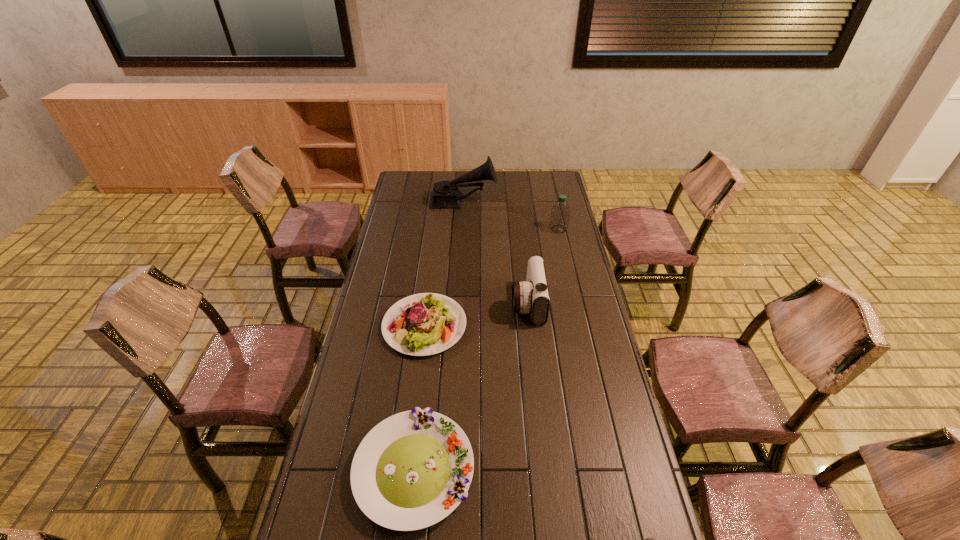
In the image, there is a desktop. Identify the location of vacant space at the far left corner. The height and width of the screenshot is (540, 960). (424, 181).

You are a GUI agent. You are given a task and a screenshot of the screen. Output one action in this format:
    pyautogui.click(x=<x>, y=<y>)
    Task: Click on the vacant space at the far right corner of the desktop
    The width and height of the screenshot is (960, 540).
    Given the screenshot: What is the action you would take?
    pyautogui.click(x=543, y=184)

Where is `empty space between the taller salad plate and the camcorder`? The image size is (960, 540). empty space between the taller salad plate and the camcorder is located at coordinates (476, 314).

At what (x,y) coordinates should I click in order to perform the action: click on vacant area between the farther salad plate and the camcorder. Please return your answer as a coordinate pair (x, y). Looking at the image, I should click on (476, 314).

Identify the location of free space between the farther salad plate and the water bottle. The width and height of the screenshot is (960, 540). (492, 278).

The height and width of the screenshot is (540, 960). Find the location of `free point between the fifth nearest object and the shorter salad plate`. free point between the fifth nearest object and the shorter salad plate is located at coordinates (486, 349).

I want to click on empty space between the water bottle and the farthest object, so click(x=511, y=215).

You are a GUI agent. You are given a task and a screenshot of the screen. Output one action in this format:
    pyautogui.click(x=<x>, y=<y>)
    Task: Click on the empty location between the second farthest object and the phonograph_record
    This screenshot has width=960, height=540.
    Given the screenshot: What is the action you would take?
    pyautogui.click(x=511, y=215)

I want to click on vacant area between the water bottle and the fifth farthest object, so (x=486, y=349).

Select which object is the second closest to the nearest object. Please provide its 2D coordinates. Your answer should be formatted as a tuple, i.e. [(x, y)], where the tuple contains the x and y coordinates of a point satisfying the conditions above.

[(423, 324)]